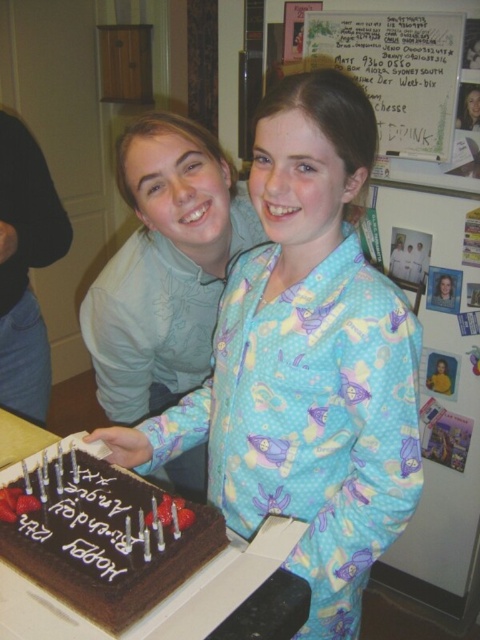
Question: Does blue cotton pajamas at center have a larger size compared to chocolatesmoothcake at center?

Choices:
 (A) no
 (B) yes

Answer: (B)

Question: Among these points, which one is nearest to the camera?

Choices:
 (A) (66, 552)
 (B) (336, 262)
 (C) (436, 40)

Answer: (A)

Question: Does blue cotton pajamas at center have a greater width compared to chocolatesmoothcake at center?

Choices:
 (A) no
 (B) yes

Answer: (B)

Question: Which of the following is the farthest from the observer?

Choices:
 (A) (181, 572)
 (B) (339, 52)

Answer: (B)

Question: Can you confirm if blue cotton pajamas at center is positioned to the right of white paper at upper center?

Choices:
 (A) no
 (B) yes

Answer: (A)

Question: Which of the following is the closest to the observer?

Choices:
 (A) chocolatesmoothcake at center
 (B) blue cotton pajamas at center
 (C) white paper at upper center

Answer: (A)